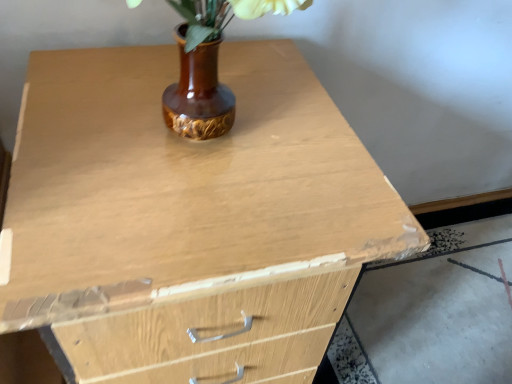
This screenshot has width=512, height=384. What are the coordinates of `browny-golden ceramic vase at center` in the screenshot? It's located at (208, 65).

Describe the element at coordinates (208, 65) in the screenshot. This screenshot has width=512, height=384. I see `browny-golden ceramic vase at center` at that location.

Identify the location of browny-golden ceramic vase at center. (208, 65).